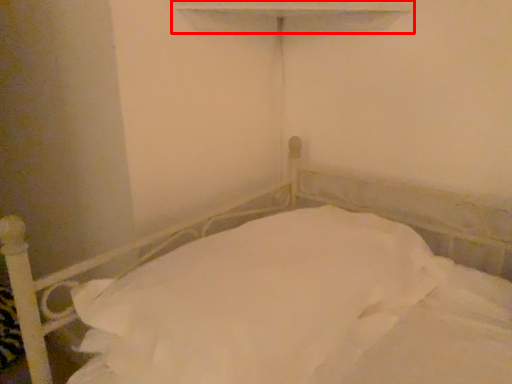
Question: Where is window sill (annotated by the red box) located in relation to bed in the image?

Choices:
 (A) left
 (B) right

Answer: (B)